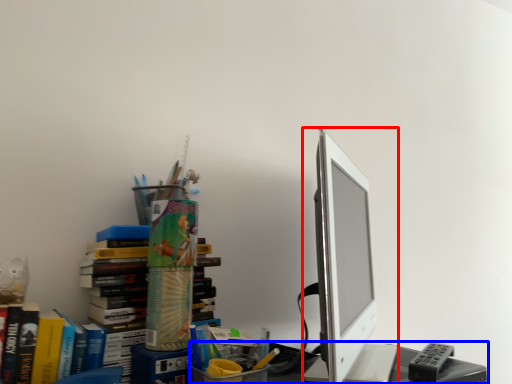
Question: Which object is further to the camera taking this photo, computer monitor (highlighted by a red box) or desk (highlighted by a blue box)?

Choices:
 (A) computer monitor
 (B) desk

Answer: (B)